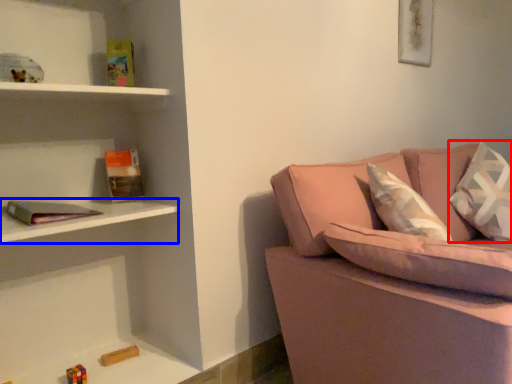
Question: Among these objects, which one is farthest to the camera, pillow (highlighted by a red box) or cabinet (highlighted by a blue box)?

Choices:
 (A) pillow
 (B) cabinet

Answer: (A)